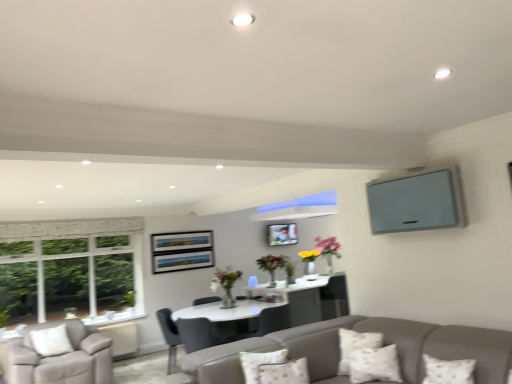
The height and width of the screenshot is (384, 512). Describe the element at coordinates (281, 234) in the screenshot. I see `metallic silver picture frame at center` at that location.

Find the location of a particular element. matte gray chair at center, arranged as the 2th chair when viewed from the left is located at coordinates (169, 337).

The width and height of the screenshot is (512, 384). I want to click on fluffy white pillow at lower center, placed as the third pillow when sorted from right to left, so click(284, 372).

What do you see at coordinates (417, 202) in the screenshot? I see `matte gray tv at upper right` at bounding box center [417, 202].

You are a GUI agent. You are given a task and a screenshot of the screen. Output one action in this format:
    pyautogui.click(x=<x>, y=<y>)
    Task: Click on the matte gray tv at upper right
    The width and height of the screenshot is (512, 384).
    Given the screenshot: What is the action you would take?
    pyautogui.click(x=417, y=202)

Image resolution: width=512 pixels, height=384 pixels. I want to click on white textured pillow at lower center, the 1th pillow positioned from the right, so click(x=374, y=364).

Looking at this image, how many degrees apart are the facing directions of fluffy white pillow at lower center, which is counted as the first pillow, starting from the left, and light gray fabric armchair at lower left, the 2th chair in the right-to-left sequence?

fluffy white pillow at lower center, which is counted as the first pillow, starting from the left, and light gray fabric armchair at lower left, the 2th chair in the right-to-left sequence, are facing 4.1 degrees away from each other.

Can you confirm if fluffy white pillow at lower center, placed as the third pillow when sorted from right to left, is wider than light gray fabric armchair at lower left, the 2th chair in the right-to-left sequence?

Yes.

Considering the sizes of objects fluffy white pillow at lower center, placed as the third pillow when sorted from right to left, and light gray fabric armchair at lower left, the 2th chair in the right-to-left sequence, in the image provided, who is smaller, fluffy white pillow at lower center, placed as the third pillow when sorted from right to left, or light gray fabric armchair at lower left, the 2th chair in the right-to-left sequence,?

fluffy white pillow at lower center, placed as the third pillow when sorted from right to left.

Would you consider fluffy white pillow at lower center, which is counted as the first pillow, starting from the left, to be distant from light gray fabric armchair at lower left, the 2th chair in the right-to-left sequence?

Absolutely, fluffy white pillow at lower center, which is counted as the first pillow, starting from the left, is distant from light gray fabric armchair at lower left, the 2th chair in the right-to-left sequence.

Is matte gray chair at center, the 1th chair from the right, next to fluffy white pillow at lower center, which is counted as the first pillow, starting from the left, and touching it?

No, matte gray chair at center, the 1th chair from the right, is not with fluffy white pillow at lower center, which is counted as the first pillow, starting from the left.

Is matte gray chair at center, the 1th chair from the right, at the right side of fluffy white pillow at lower center, which is counted as the first pillow, starting from the left?

Incorrect, matte gray chair at center, the 1th chair from the right, is not on the right side of fluffy white pillow at lower center, which is counted as the first pillow, starting from the left.

Which is in front, point (159, 323) or point (292, 368)?

The point (292, 368) is in front.

Is matte gray chair at center, the 1th chair from the right, positioned with its back to fluffy white pillow at lower center, placed as the third pillow when sorted from right to left?

matte gray chair at center, the 1th chair from the right, does not have its back to fluffy white pillow at lower center, placed as the third pillow when sorted from right to left.

Can you tell me how much metallic silver picture frame at center and matte gray tv at upper right differ in facing direction?

89.8 degrees.

Would you say matte gray tv at upper right is part of metallic silver picture frame at center's contents?

No, matte gray tv at upper right is not surrounded by metallic silver picture frame at center.

How far apart are metallic silver picture frame at center and matte gray tv at upper right?

They are 2.42 meters apart.

From the image's perspective, is metallic silver picture frame at center located beneath matte gray tv at upper right?

Yes, from the image's perspective, metallic silver picture frame at center is below matte gray tv at upper right.

Is light gray fabric armchair at lower left, the 2th chair in the right-to-left sequence, shorter than white textured pillow at lower center, which is the third pillow from left to right?

In fact, light gray fabric armchair at lower left, the 2th chair in the right-to-left sequence, may be taller than white textured pillow at lower center, which is the third pillow from left to right.

Is light gray fabric armchair at lower left, the 1th chair from the left, further to the viewer compared to white textured pillow at lower center, which is the third pillow from left to right?

Yes, the depth of light gray fabric armchair at lower left, the 1th chair from the left, is greater than that of white textured pillow at lower center, which is the third pillow from left to right.

In the scene shown: Can white textured pillow at lower center, which is the third pillow from left to right, be found inside light gray fabric armchair at lower left, the 2th chair in the right-to-left sequence?

No, light gray fabric armchair at lower left, the 2th chair in the right-to-left sequence, does not contain white textured pillow at lower center, which is the third pillow from left to right.

Considering the sizes of objects light gray fabric armchair at lower left, the 2th chair in the right-to-left sequence, and white textured pillow at lower center, which is the third pillow from left to right, in the image provided, who is smaller, light gray fabric armchair at lower left, the 2th chair in the right-to-left sequence, or white textured pillow at lower center, which is the third pillow from left to right,?

With smaller size is white textured pillow at lower center, which is the third pillow from left to right.

Considering the sizes of objects metallic silver picture frame at center and white textured pillow at lower right, arranged as the 2th pillow when viewed from the left, in the image provided, who is thinner, metallic silver picture frame at center or white textured pillow at lower right, arranged as the 2th pillow when viewed from the left,?

With smaller width is metallic silver picture frame at center.

Is metallic silver picture frame at center situated inside white textured pillow at lower right, arranged as the 2th pillow when viewed from the left, or outside?

metallic silver picture frame at center is not enclosed by white textured pillow at lower right, arranged as the 2th pillow when viewed from the left.

From a real-world perspective, relative to white textured pillow at lower right, placed as the second pillow when sorted from right to left, is metallic silver picture frame at center vertically above or below?

In terms of real-world spatial position, metallic silver picture frame at center is above white textured pillow at lower right, placed as the second pillow when sorted from right to left.

Is metallic silver picture frame at center far away from white textured pillow at lower right, placed as the second pillow when sorted from right to left?

That's right, there is a large distance between metallic silver picture frame at center and white textured pillow at lower right, placed as the second pillow when sorted from right to left.

Which point is more forward, (346, 373) or (62, 357)?

The point (346, 373) is closer to the camera.

Is light gray fabric armchair at lower left, the 2th chair in the right-to-left sequence, at the back of white textured pillow at lower right, placed as the second pillow when sorted from right to left?

white textured pillow at lower right, placed as the second pillow when sorted from right to left, is not turned away from light gray fabric armchair at lower left, the 2th chair in the right-to-left sequence.

From the image's perspective, relative to light gray fabric armchair at lower left, the 1th chair from the left, is white textured pillow at lower right, arranged as the 2th pillow when viewed from the left, above or below?

white textured pillow at lower right, arranged as the 2th pillow when viewed from the left, is above light gray fabric armchair at lower left, the 1th chair from the left.

Is white textured pillow at lower right, arranged as the 2th pillow when viewed from the left, bigger than light gray fabric armchair at lower left, the 2th chair in the right-to-left sequence?

No.

In the image, is fluffy white pillow at lower center, which is counted as the first pillow, starting from the left, on the left side or the right side of white textured pillow at lower right, arranged as the 2th pillow when viewed from the left?

fluffy white pillow at lower center, which is counted as the first pillow, starting from the left, is positioned on white textured pillow at lower right, arranged as the 2th pillow when viewed from the left,'s left side.

From a real-world perspective, is fluffy white pillow at lower center, which is counted as the first pillow, starting from the left, located higher than white textured pillow at lower right, placed as the second pillow when sorted from right to left?

Yes.

Is fluffy white pillow at lower center, placed as the third pillow when sorted from right to left, positioned beyond the bounds of white textured pillow at lower right, arranged as the 2th pillow when viewed from the left?

Absolutely, fluffy white pillow at lower center, placed as the third pillow when sorted from right to left, is external to white textured pillow at lower right, arranged as the 2th pillow when viewed from the left.

Based on the photo, could you tell me if fluffy white pillow at lower center, which is counted as the first pillow, starting from the left, is turned towards white textured pillow at lower right, arranged as the 2th pillow when viewed from the left?

No, fluffy white pillow at lower center, which is counted as the first pillow, starting from the left, is not turned towards white textured pillow at lower right, arranged as the 2th pillow when viewed from the left.

Which chair is the 2nd one when counting from the back of the fluffy white pillow at lower center, placed as the third pillow when sorted from right to left? Please provide its 2D coordinates.

[(61, 358)]

Where is `the 3rd pillow in front of the matte gray chair at center, the 1th chair from the right, counting from the anchor's position`? The width and height of the screenshot is (512, 384). the 3rd pillow in front of the matte gray chair at center, the 1th chair from the right, counting from the anchor's position is located at coordinates (284, 372).

Based on the photo, looking at the image, which one is located closer to white textured pillow at lower center, which is the third pillow from left to right, matte gray chair at center, arranged as the 2th chair when viewed from the left, or metallic silver picture frame at center?

matte gray chair at center, arranged as the 2th chair when viewed from the left.

Looking at the image, which one is located further to metallic silver picture frame at center, white textured pillow at lower right, placed as the second pillow when sorted from right to left, or light gray fabric armchair at lower left, the 2th chair in the right-to-left sequence?

light gray fabric armchair at lower left, the 2th chair in the right-to-left sequence, is further to metallic silver picture frame at center.

From the image, which object appears to be nearer to metallic silver picture frame at center, matte gray tv at upper right or white textured pillow at lower center, which is the third pillow from left to right?

Among the two, matte gray tv at upper right is located nearer to metallic silver picture frame at center.

Based on their spatial positions, is white textured pillow at lower center, which is the third pillow from left to right, or matte gray chair at center, arranged as the 2th chair when viewed from the left, further from white textured pillow at lower right, placed as the second pillow when sorted from right to left?

matte gray chair at center, arranged as the 2th chair when viewed from the left, is further to white textured pillow at lower right, placed as the second pillow when sorted from right to left.

Which object lies nearer to the anchor point light gray fabric armchair at lower left, the 2th chair in the right-to-left sequence, white textured pillow at lower center, the 1th pillow positioned from the right, or matte gray tv at upper right?

white textured pillow at lower center, the 1th pillow positioned from the right.

When comparing their distances from matte gray chair at center, the 1th chair from the right, does metallic silver picture frame at center or white textured pillow at lower right, arranged as the 2th pillow when viewed from the left, seem further?

white textured pillow at lower right, arranged as the 2th pillow when viewed from the left, is positioned further to the anchor matte gray chair at center, the 1th chair from the right.

Which object lies nearer to the anchor point fluffy white pillow at lower center, placed as the third pillow when sorted from right to left, white textured pillow at lower right, arranged as the 2th pillow when viewed from the left, or metallic silver picture frame at center?

The object closer to fluffy white pillow at lower center, placed as the third pillow when sorted from right to left, is white textured pillow at lower right, arranged as the 2th pillow when viewed from the left.

In the scene shown: Looking at the image, which one is located closer to light gray fabric armchair at lower left, the 2th chair in the right-to-left sequence, white textured pillow at lower center, which is the third pillow from left to right, or matte gray chair at center, the 1th chair from the right?

→ matte gray chair at center, the 1th chair from the right, is positioned closer to the anchor light gray fabric armchair at lower left, the 2th chair in the right-to-left sequence.

The width and height of the screenshot is (512, 384). In order to click on window screen between fluffy white pillow at lower center, which is counted as the first pillow, starting from the left, and matte gray chair at center, the 1th chair from the right, along the z-axis in this screenshot , I will do `click(417, 202)`.

Identify the location of chair between light gray fabric armchair at lower left, the 2th chair in the right-to-left sequence, and matte gray tv at upper right, in the horizontal direction. The image size is (512, 384). pyautogui.click(x=169, y=337).

Where is `pillow situated between light gray fabric armchair at lower left, the 2th chair in the right-to-left sequence, and white textured pillow at lower right, placed as the second pillow when sorted from right to left, from left to right`? The height and width of the screenshot is (384, 512). pillow situated between light gray fabric armchair at lower left, the 2th chair in the right-to-left sequence, and white textured pillow at lower right, placed as the second pillow when sorted from right to left, from left to right is located at coordinates (284, 372).

Where is `window screen between white textured pillow at lower center, the 1th pillow positioned from the right, and metallic silver picture frame at center, along the z-axis`? The image size is (512, 384). window screen between white textured pillow at lower center, the 1th pillow positioned from the right, and metallic silver picture frame at center, along the z-axis is located at coordinates (417, 202).